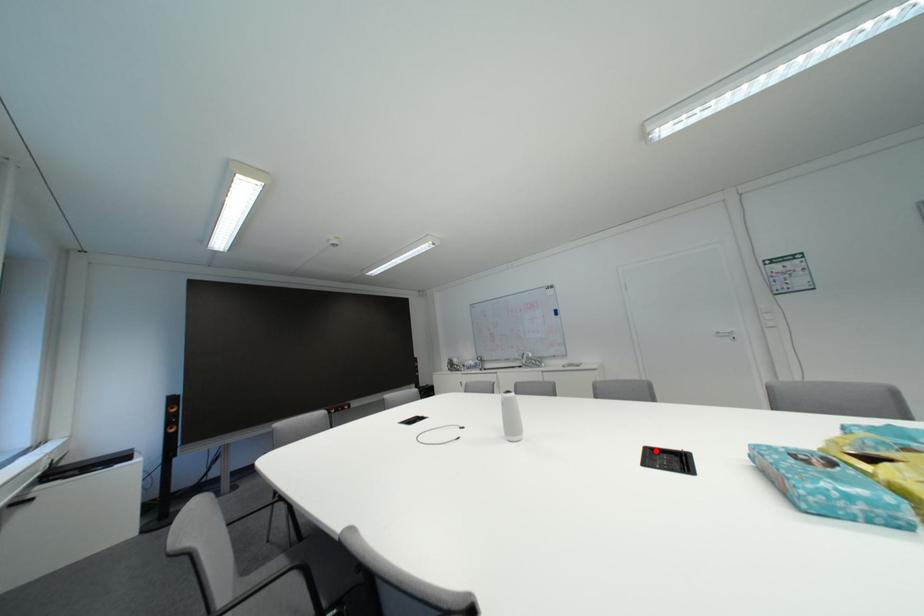
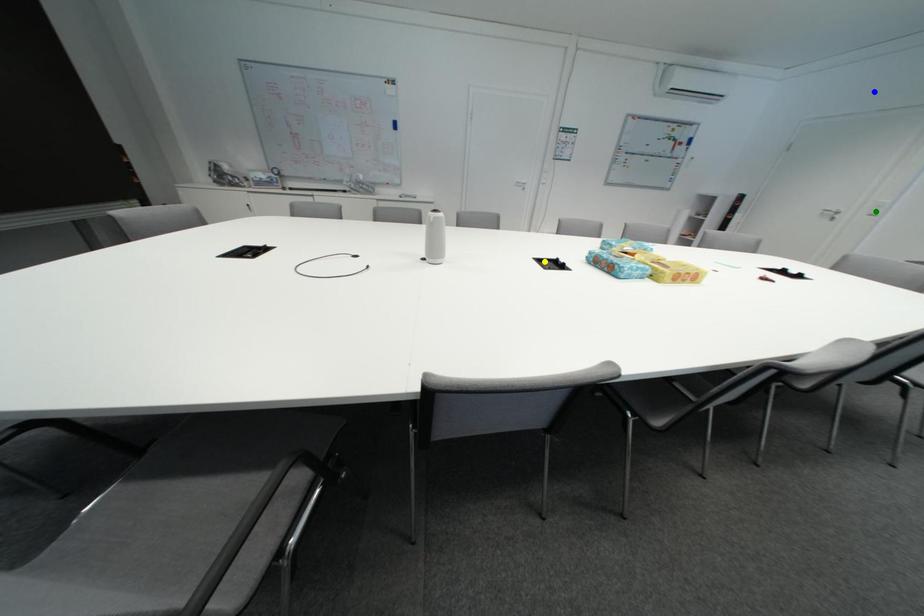
Question: I am providing you with two images of the same scene from different viewpoints. A red point is marked on the first image. You are given multiple points on the second image. Can you choose the point in image 2 that corresponds to the point in image 1?

Choices:
 (A) green point
 (B) yellow point
 (C) blue point

Answer: (B)